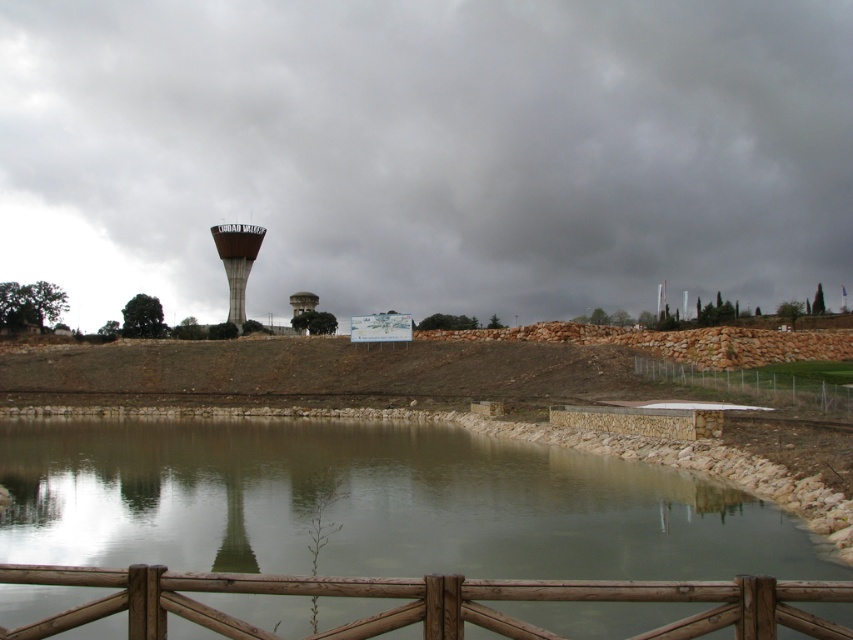
Which is more to the left, transparent water at center or metallic gray water tower at center?

metallic gray water tower at center

Which is in front, point (157, 451) or point (236, 269)?

Point (157, 451)

Is point (769, 595) farther from viewer compared to point (238, 259)?

No.

Image resolution: width=853 pixels, height=640 pixels. I want to click on transparent water at center, so click(390, 600).

What do you see at coordinates (390, 600) in the screenshot? The height and width of the screenshot is (640, 853). I see `transparent water at center` at bounding box center [390, 600].

Is point (241, 486) positioned in front of point (28, 627)?

No, (241, 486) is behind (28, 627).

I want to click on transparent water at center, so click(390, 600).

What do you see at coordinates (424, 602) in the screenshot?
I see `brown wooden rail at lower center` at bounding box center [424, 602].

Does point (428, 600) come closer to viewer compared to point (221, 257)?

Yes, point (428, 600) is closer to viewer.

This screenshot has width=853, height=640. I want to click on brown wooden rail at lower center, so click(424, 602).